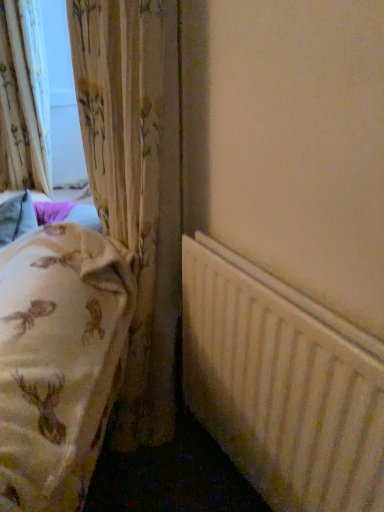
Question: Is white matte radiator at lower right next to floral fabric curtain at left, the second curtain viewed from the left?

Choices:
 (A) yes
 (B) no

Answer: (B)

Question: Does white matte radiator at lower right have a smaller size compared to floral fabric curtain at left, which is the 2th curtain from back to front?

Choices:
 (A) yes
 (B) no

Answer: (A)

Question: Is white matte radiator at lower right further to camera compared to floral fabric curtain at left, the second curtain viewed from the left?

Choices:
 (A) yes
 (B) no

Answer: (B)

Question: From a real-world perspective, is white matte radiator at lower right on top of floral fabric curtain at left, the second curtain viewed from the left?

Choices:
 (A) yes
 (B) no

Answer: (B)

Question: Is white matte radiator at lower right looking in the opposite direction of floral fabric curtain at left, the 1th curtain in the front-to-back sequence?

Choices:
 (A) yes
 (B) no

Answer: (B)

Question: Is floral fabric curtain at left, marked as the 1th curtain in a left-to-right arrangement, taller or shorter than white matte radiator at lower right?

Choices:
 (A) tall
 (B) short

Answer: (A)

Question: Considering the positions of floral fabric curtain at left, positioned as the second curtain in front-to-back order, and white matte radiator at lower right in the image, is floral fabric curtain at left, positioned as the second curtain in front-to-back order, bigger or smaller than white matte radiator at lower right?

Choices:
 (A) small
 (B) big

Answer: (B)

Question: Is floral fabric curtain at left, positioned as the second curtain in front-to-back order, wider or thinner than white matte radiator at lower right?

Choices:
 (A) thin
 (B) wide

Answer: (B)

Question: Is point (13, 130) closer or farther from the camera than point (283, 474)?

Choices:
 (A) farther
 (B) closer

Answer: (A)

Question: Which is correct: floral fabric curtain at left, the 1th curtain in the front-to-back sequence, is inside white matte radiator at lower right, or outside of it?

Choices:
 (A) outside
 (B) inside

Answer: (A)

Question: From their relative heights in the image, would you say floral fabric curtain at left, acting as the first curtain starting from the right, is taller or shorter than white matte radiator at lower right?

Choices:
 (A) tall
 (B) short

Answer: (A)

Question: From the image's perspective, is floral fabric curtain at left, the second curtain viewed from the left, positioned above or below white matte radiator at lower right?

Choices:
 (A) below
 (B) above

Answer: (B)

Question: In terms of size, does floral fabric curtain at left, the second curtain viewed from the left, appear bigger or smaller than white matte radiator at lower right?

Choices:
 (A) big
 (B) small

Answer: (A)

Question: Is floral fabric curtain at left, which appears as the 2th curtain when viewed from the right, in front of or behind floral fabric curtain at left, acting as the first curtain starting from the right, in the image?

Choices:
 (A) front
 (B) behind

Answer: (B)

Question: In terms of height, does floral fabric curtain at left, positioned as the second curtain in front-to-back order, look taller or shorter compared to floral fabric curtain at left, the 1th curtain in the front-to-back sequence?

Choices:
 (A) tall
 (B) short

Answer: (B)